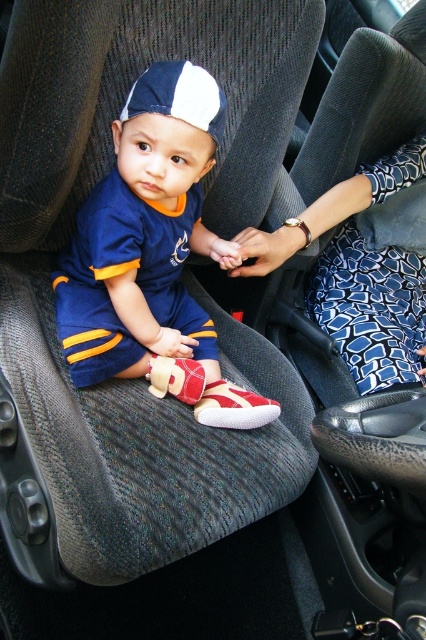
You are a passenger in the car and want to reach a snack located at point (386, 337) and point (224, 97). Which point is closer to you?

Point (386, 337) is further to the viewer than point (224, 97), so the point closer to you is point (224, 97).

You are a passenger in the car and want to hand a toy to the child sitting on the driver seat. The toy is placed on the matte blue jersey at center. To reach the toy, do you need to move the white and navy blue fabric baseball cap at center that is also at center?

The white and navy blue fabric baseball cap at center is behind the matte blue jersey at center, so you can reach the toy on the matte blue jersey at center without moving the cap.

You are sitting in the back seat of the car and looking forward. There are two points marked in the driver seat area. Which point is closer to you, point (132, 140) or point (183, 93)?

Point (132, 140) is closer to you because it is further to the viewer than point (183, 93).